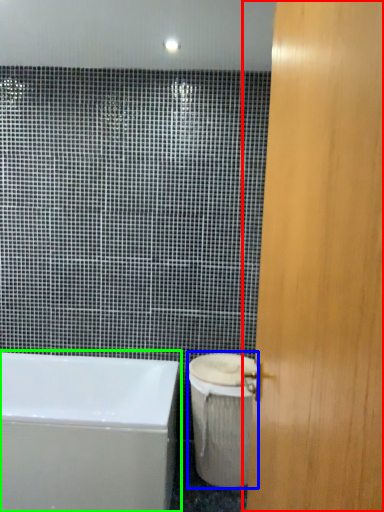
Question: Based on their relative distances, which object is farther from door (highlighted by a red box)? Choose from toilet bowl (highlighted by a blue box) and bathtub (highlighted by a green box).

Choices:
 (A) toilet bowl
 (B) bathtub

Answer: (B)